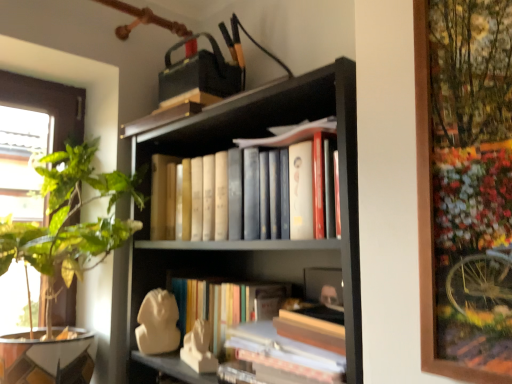
Question: Is matte black bookcase at center closer to the viewer compared to hardcover books at center?

Choices:
 (A) yes
 (B) no

Answer: (A)

Question: From a real-world perspective, does matte black bookcase at center stand above hardcover books at center?

Choices:
 (A) no
 (B) yes

Answer: (A)

Question: Is matte black bookcase at center at the left side of hardcover books at center?

Choices:
 (A) no
 (B) yes

Answer: (A)

Question: Can you confirm if matte black bookcase at center is positioned to the right of hardcover books at center?

Choices:
 (A) no
 (B) yes

Answer: (B)

Question: Is matte black bookcase at center thinner than hardcover books at center?

Choices:
 (A) no
 (B) yes

Answer: (A)

Question: Relative to hardcover books at center, is green leafy plant at left in front or behind?

Choices:
 (A) front
 (B) behind

Answer: (A)

Question: Is green leafy plant at left inside the boundaries of hardcover books at center, or outside?

Choices:
 (A) inside
 (B) outside

Answer: (B)

Question: From their relative heights in the image, would you say green leafy plant at left is taller or shorter than hardcover books at center?

Choices:
 (A) short
 (B) tall

Answer: (B)

Question: From a real-world perspective, is green leafy plant at left above or below hardcover books at center?

Choices:
 (A) above
 (B) below

Answer: (B)

Question: From the image's perspective, is hardcover books at center above or below green leafy plant at left?

Choices:
 (A) above
 (B) below

Answer: (A)

Question: Looking at their shapes, would you say hardcover books at center is wider or thinner than green leafy plant at left?

Choices:
 (A) wide
 (B) thin

Answer: (B)

Question: Looking at the image, does hardcover books at center seem bigger or smaller compared to green leafy plant at left?

Choices:
 (A) big
 (B) small

Answer: (B)

Question: From their relative heights in the image, would you say hardcover books at center is taller or shorter than green leafy plant at left?

Choices:
 (A) tall
 (B) short

Answer: (B)

Question: In terms of size, does hardcover books at center appear bigger or smaller than matte black bookcase at center?

Choices:
 (A) small
 (B) big

Answer: (A)

Question: In the image, is hardcover books at center positioned in front of or behind matte black bookcase at center?

Choices:
 (A) behind
 (B) front

Answer: (A)